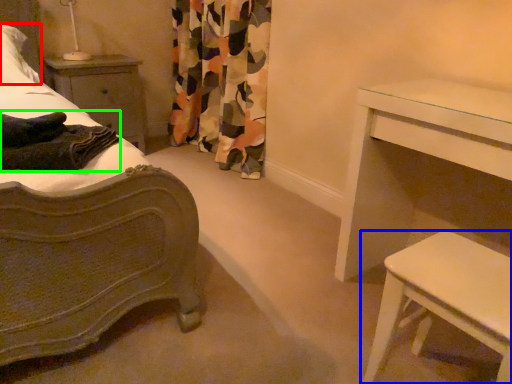
Question: Based on their relative distances, which object is nearer to pillow (highlighted by a red box)? Choose from table (highlighted by a blue box) and blanket (highlighted by a green box).

Choices:
 (A) table
 (B) blanket

Answer: (B)